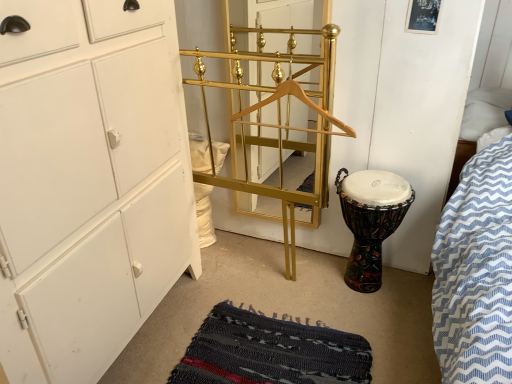
Question: Can you confirm if rag-textured mat at lower center is bigger than gold/metallic coat rack at center?

Choices:
 (A) no
 (B) yes

Answer: (B)

Question: Is rag-textured mat at lower center at the right side of gold/metallic coat rack at center?

Choices:
 (A) yes
 (B) no

Answer: (B)

Question: Could you tell me if rag-textured mat at lower center is facing gold/metallic coat rack at center?

Choices:
 (A) yes
 (B) no

Answer: (B)

Question: Is rag-textured mat at lower center touching gold/metallic coat rack at center?

Choices:
 (A) no
 (B) yes

Answer: (A)

Question: From a real-world perspective, is rag-textured mat at lower center located beneath gold/metallic coat rack at center?

Choices:
 (A) yes
 (B) no

Answer: (A)

Question: Considering the relative sizes of rag-textured mat at lower center and gold/metallic coat rack at center in the image provided, is rag-textured mat at lower center shorter than gold/metallic coat rack at center?

Choices:
 (A) yes
 (B) no

Answer: (A)

Question: From a real-world perspective, is gold/metallic coat rack at center over wooden hanger at center?

Choices:
 (A) no
 (B) yes

Answer: (A)

Question: Is gold/metallic coat rack at center turned away from wooden hanger at center?

Choices:
 (A) yes
 (B) no

Answer: (B)

Question: Does gold/metallic coat rack at center have a greater height compared to wooden hanger at center?

Choices:
 (A) no
 (B) yes

Answer: (B)

Question: From a real-world perspective, is gold/metallic coat rack at center located beneath wooden hanger at center?

Choices:
 (A) no
 (B) yes

Answer: (B)

Question: Is gold/metallic coat rack at center facing towards wooden hanger at center?

Choices:
 (A) yes
 (B) no

Answer: (A)

Question: Is gold/metallic coat rack at center at the left side of wooden hanger at center?

Choices:
 (A) yes
 (B) no

Answer: (A)

Question: Considering the relative sizes of multicolored painted drum at lower right and gold/metallic coat rack at center in the image provided, is multicolored painted drum at lower right taller than gold/metallic coat rack at center?

Choices:
 (A) no
 (B) yes

Answer: (A)